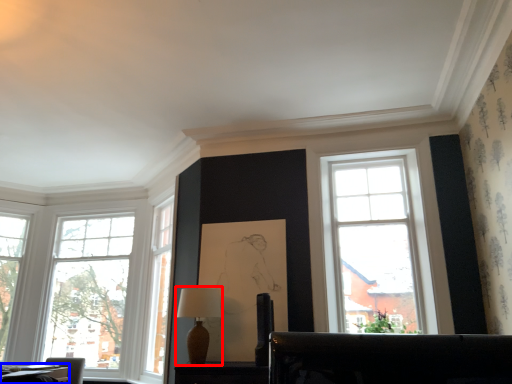
Question: Which object appears closest to the camera in this image, table lamp (highlighted by a red box) or table (highlighted by a blue box)?

Choices:
 (A) table lamp
 (B) table

Answer: (B)